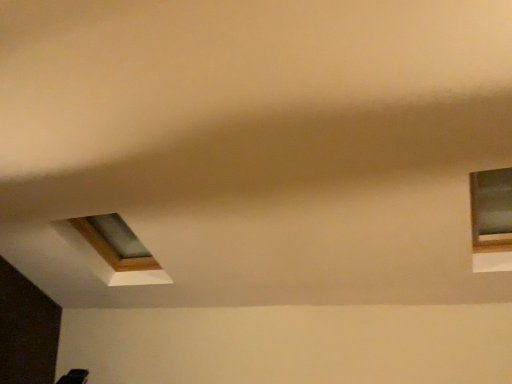
Question: Is point (88, 231) positioned closer to the camera than point (501, 170)?

Choices:
 (A) farther
 (B) closer

Answer: (A)

Question: Is transparent glass window at upper left, placed as the 2th window when sorted from front to back, to the left or to the right of matte glass window at upper right, the second window in the left-to-right sequence, in the image?

Choices:
 (A) left
 (B) right

Answer: (A)

Question: Considering the positions of transparent glass window at upper left, placed as the 2th window when sorted from front to back, and matte glass window at upper right, the 1th window when ordered from right to left, in the image, is transparent glass window at upper left, placed as the 2th window when sorted from front to back, bigger or smaller than matte glass window at upper right, the 1th window when ordered from right to left,?

Choices:
 (A) small
 (B) big

Answer: (B)

Question: From the image's perspective, is matte glass window at upper right, which is the 2th window from back to front, positioned above or below transparent glass window at upper left, which is counted as the 1th window, starting from the back?

Choices:
 (A) above
 (B) below

Answer: (A)

Question: Is matte glass window at upper right, the 1th window from the front, inside the boundaries of transparent glass window at upper left, placed as the 2th window when sorted from front to back, or outside?

Choices:
 (A) outside
 (B) inside

Answer: (A)

Question: Does point tap(495, 198) appear closer or farther from the camera than point tap(118, 253)?

Choices:
 (A) closer
 (B) farther

Answer: (A)

Question: In the image, is matte glass window at upper right, which is the 2th window from back to front, positioned in front of or behind transparent glass window at upper left, which appears as the 2th window when viewed from the right?

Choices:
 (A) behind
 (B) front

Answer: (B)